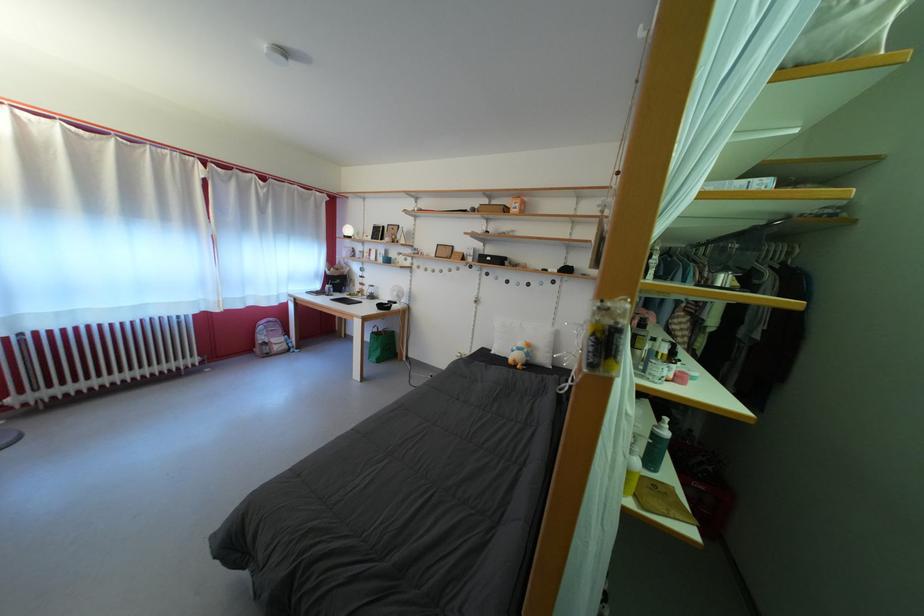
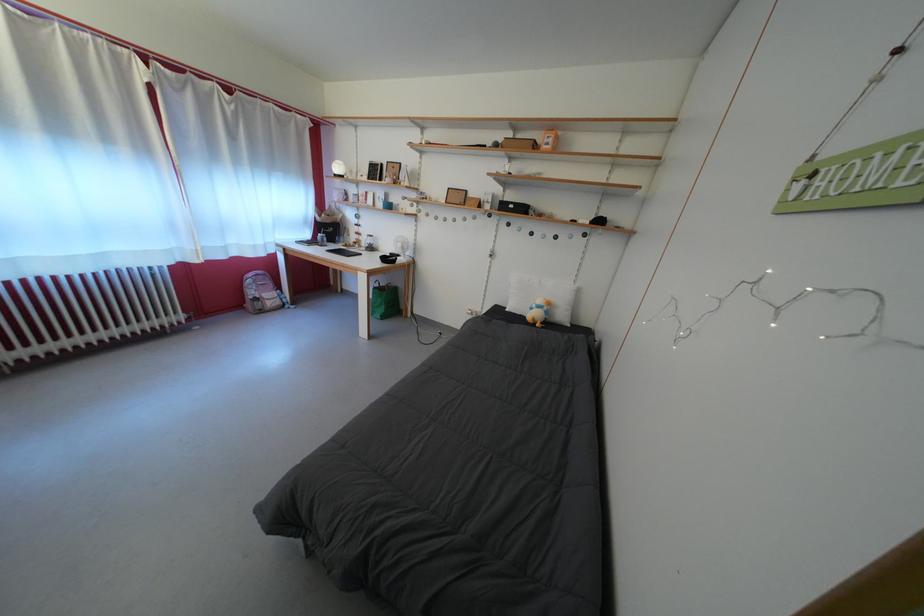
Which direction would the cameraman need to move to produce the second image?

The cameraman walked toward left, forward.